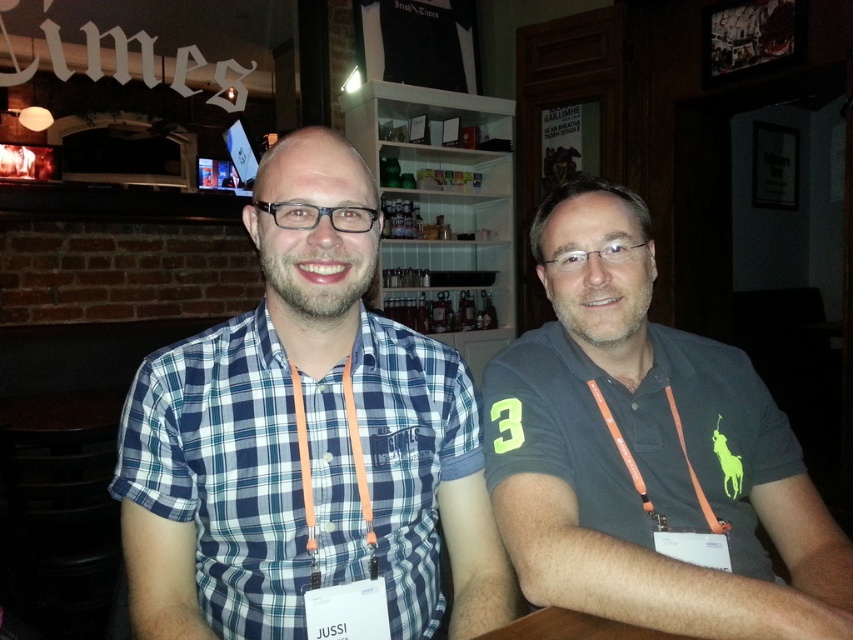
You are taking a photo of two people at a bar. You notice two points in the image at coordinates point (410, 609) and point (547, 609). If you want to focus on the point closer to the camera, which coordinate should you choose?

Point (410, 609) is further to the camera than point (547, 609), so you should choose point (410, 609) to focus on the closer point.

You are standing in a bar and see the blue plaid shirt at center. Can you estimate its location in terms of coordinates?

The blue plaid shirt at center is located at coordinates point [305,440].